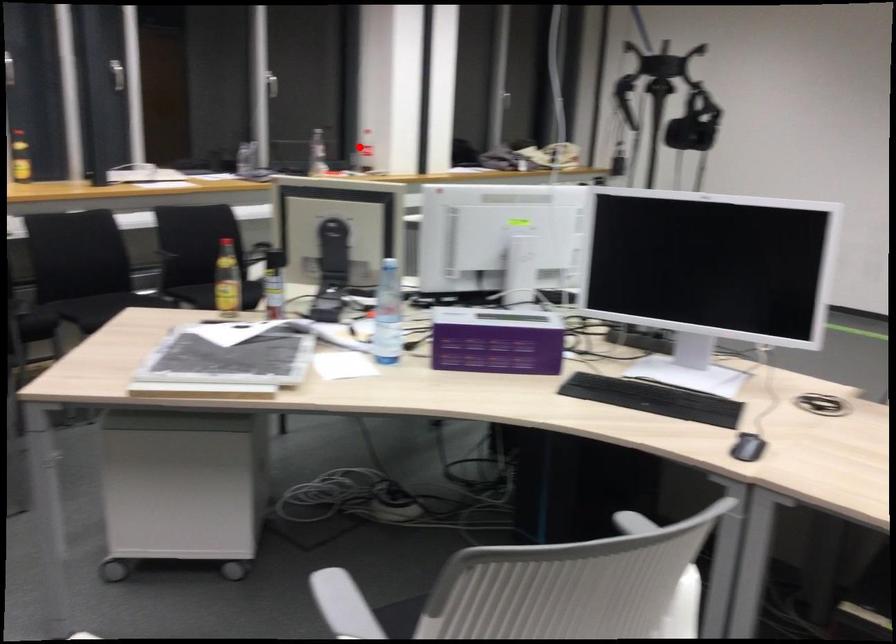
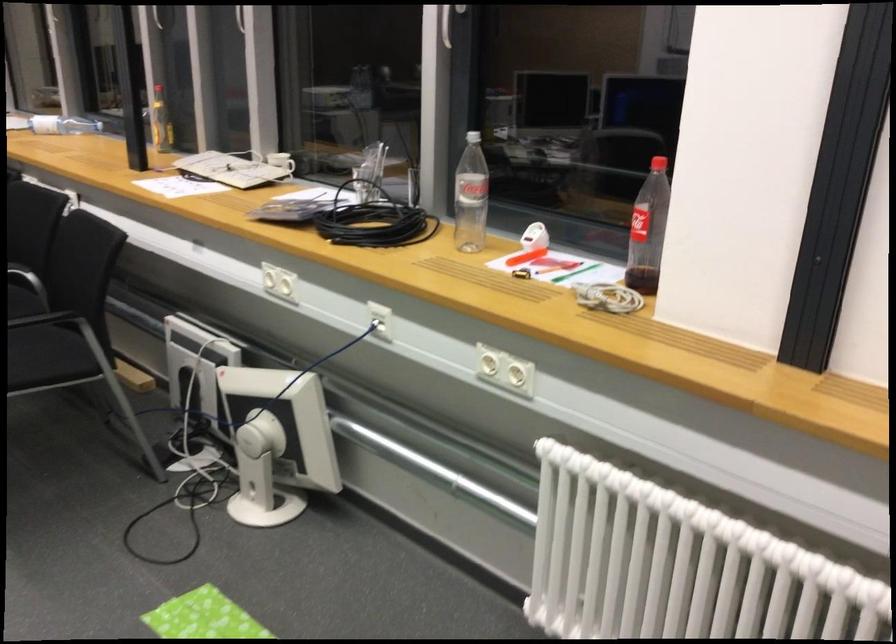
Locate, in the second image, the point that corresponds to the highlighted location in the first image.

(648, 230)